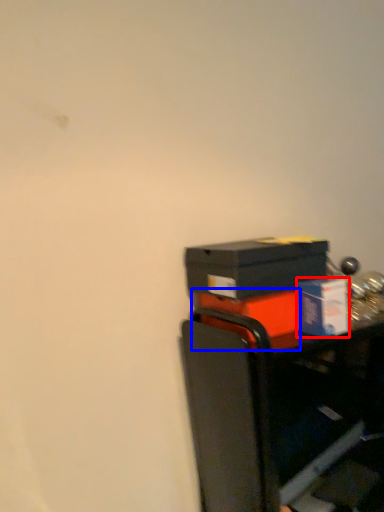
Question: Which object is closer to the camera taking this photo, box (highlighted by a red box) or box (highlighted by a blue box)?

Choices:
 (A) box
 (B) box

Answer: (A)